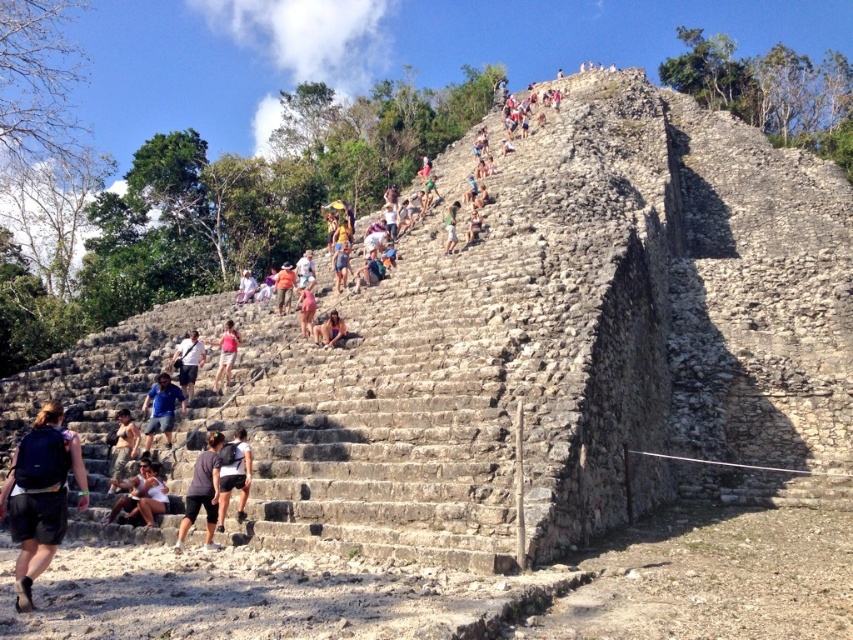
You are a photographer planning to take a picture of the tourists on the ancient stone staircase leading to the pyramid. You need to ensure that both the matte pink bikini at center and the white cotton shirt at center are clearly visible in the frame. Considering their sizes, which object should you focus on to ensure both are in focus?

The matte pink bikini at center is narrower than the white cotton shirt at center. To ensure both are in focus, you should focus on the white cotton shirt at center since it is wider, allowing the narrower matte pink bikini at center to stay within the depth of field.

You are a tour guide leading a group up the stone staircase to the pyramid. One of your tourists asks if they can safely step onto the dark gray stone shorts at center from the green fabric shirt at upper center. Based on the width of these objects, can they make this move?

The dark gray stone shorts at center might be wider than green fabric shirt at upper center, so it is possible to step onto the dark gray stone shorts at center from the green fabric shirt at upper center safely.

You are standing at the base of the pyramid and want to take a photo of the dark gray stone shorts at center. Where should you position yourself to capture the best view of it?

The dark gray stone shorts at center is located at point 0.744 on the x axis and 0.275 on the y axis, so you should position yourself directly in front of it to capture the best view.